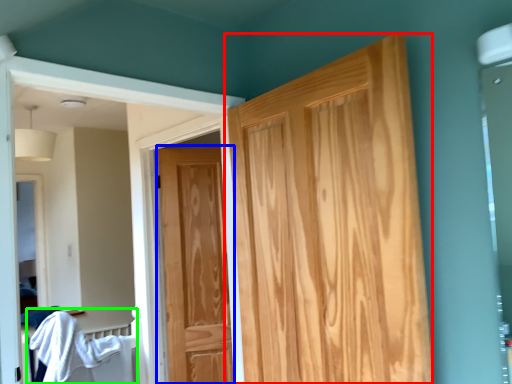
Question: Which object is the farthest from door (highlighted by a red box)? Choose among these: door (highlighted by a blue box) or bed (highlighted by a green box).

Choices:
 (A) door
 (B) bed

Answer: (B)